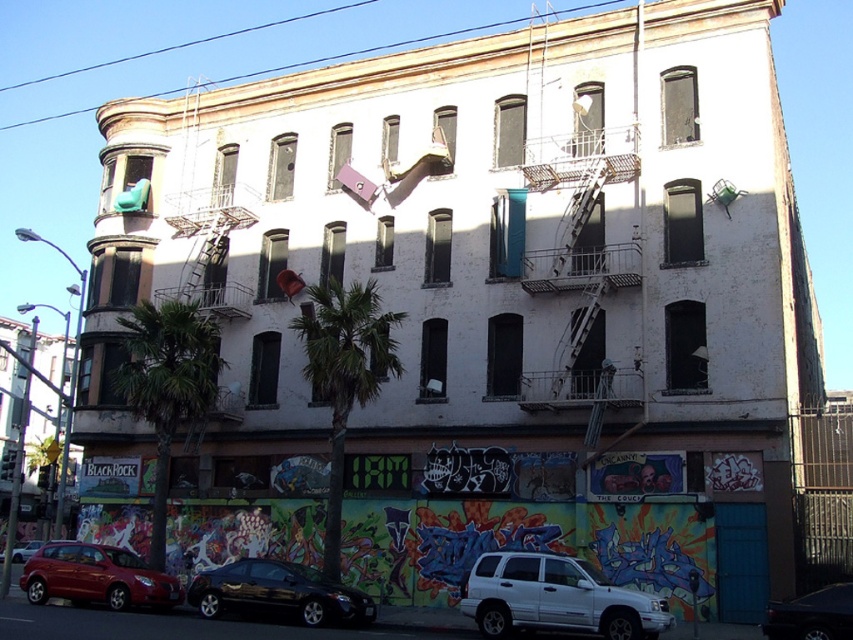
Can you confirm if shiny black car at lower center is shorter than shiny red sedan at lower left?

Correct, shiny black car at lower center is not as tall as shiny red sedan at lower left.

Is shiny black car at lower center to the right of shiny red sedan at lower left from the viewer's perspective?

Indeed, shiny black car at lower center is positioned on the right side of shiny red sedan at lower left.

At what (x,y) coordinates should I click in order to perform the action: click on shiny black car at lower center. Please return your answer as a coordinate pair (x, y). The image size is (853, 640). Looking at the image, I should click on (277, 593).

The height and width of the screenshot is (640, 853). In order to click on shiny black car at lower center in this screenshot , I will do `click(277, 593)`.

Does white matte suv at lower center have a lesser width compared to shiny black truck at lower right?

Correct, white matte suv at lower center's width is less than shiny black truck at lower right's.

Find the location of a particular element. white matte suv at lower center is located at coordinates (556, 598).

Which is above, shiny black truck at lower right or shiny red sedan at lower left?

shiny black truck at lower right is above.

Can you confirm if shiny black truck at lower right is smaller than shiny red sedan at lower left?

Correct, shiny black truck at lower right occupies less space than shiny red sedan at lower left.

Between point (816, 636) and point (15, 550), which one is positioned behind?

The point (15, 550) is more distant.

Where is `shiny black truck at lower right`? This screenshot has height=640, width=853. shiny black truck at lower right is located at coordinates (811, 614).